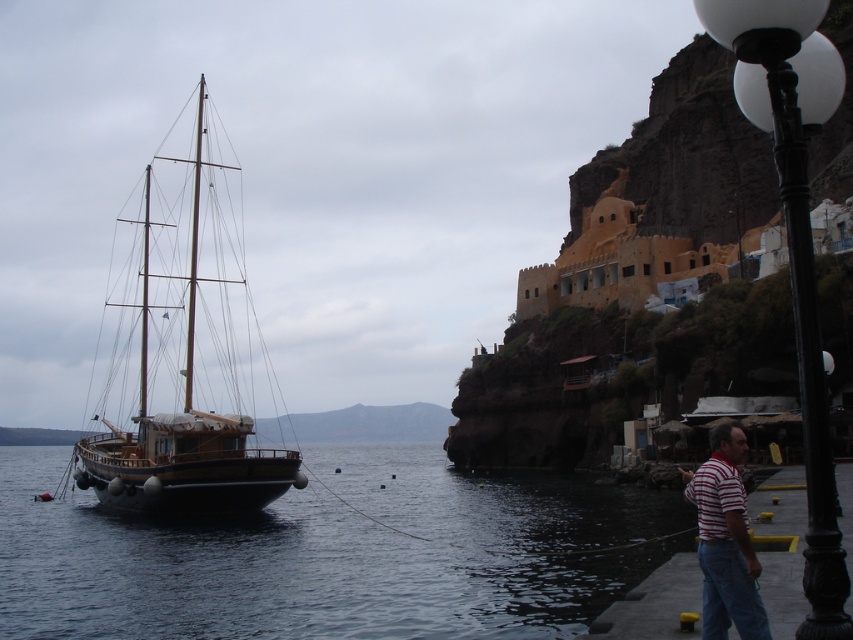
Between dark blue water at left and wooden sailboat at left, which one appears on the left side from the viewer's perspective?

dark blue water at left is more to the left.

Between point (294, 548) and point (219, 256), which one is positioned behind?

The point (219, 256) is behind.

Which is in front, point (183, 573) or point (281, 481)?

Point (183, 573)

Locate an element on the screen. dark blue water at left is located at coordinates (329, 554).

Can you confirm if wooden sailboat at left is smaller than striped cotton shirt at lower right?

Actually, wooden sailboat at left might be larger than striped cotton shirt at lower right.

Is wooden sailboat at left to the right of striped cotton shirt at lower right from the viewer's perspective?

Incorrect, wooden sailboat at left is not on the right side of striped cotton shirt at lower right.

I want to click on wooden sailboat at left, so click(184, 356).

Can you confirm if dark blue water at left is taller than black metal lamp post at lower right?

Yes, dark blue water at left is taller than black metal lamp post at lower right.

Is point (300, 566) positioned after point (804, 154)?

Yes, point (300, 566) is behind point (804, 154).

Identify the location of dark blue water at left. Image resolution: width=853 pixels, height=640 pixels. (329, 554).